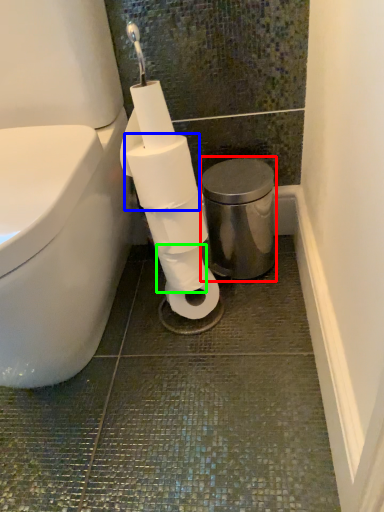
Question: Which is nearer to the bidet (highlighted by a red box)? toilet paper (highlighted by a blue box) or toilet paper (highlighted by a green box).

Choices:
 (A) toilet paper
 (B) toilet paper

Answer: (B)